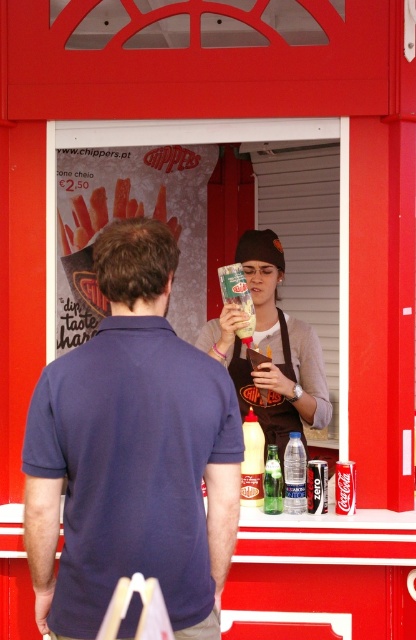
Is navy blue polo shirt at center to the left of clear plastic bottle at center from the viewer's perspective?

Yes, navy blue polo shirt at center is to the left of clear plastic bottle at center.

Is navy blue polo shirt at center shorter than clear plastic bottle at center?

In fact, navy blue polo shirt at center may be taller than clear plastic bottle at center.

Who is more distant from viewer, [188,480] or [284,456]?

The point [284,456] is behind.

The width and height of the screenshot is (416, 640). I want to click on navy blue polo shirt at center, so click(131, 454).

Does matte cardboard sign at center appear under yellow plastic bottle at center?

Actually, matte cardboard sign at center is above yellow plastic bottle at center.

Looking at this image, between matte cardboard sign at center and yellow plastic bottle at center, which one appears on the right side from the viewer's perspective?

yellow plastic bottle at center

Is point (163, 198) positioned in front of point (257, 438)?

No, it is behind (257, 438).

This screenshot has height=640, width=416. I want to click on matte cardboard sign at center, so click(83, 220).

Between navy blue polo shirt at center and brown fabric apron at center, which one has less height?

brown fabric apron at center is shorter.

Which is behind, point (198, 566) or point (262, 380)?

The point (262, 380) is more distant.

Where is `navy blue polo shirt at center`? The height and width of the screenshot is (640, 416). navy blue polo shirt at center is located at coordinates (131, 454).